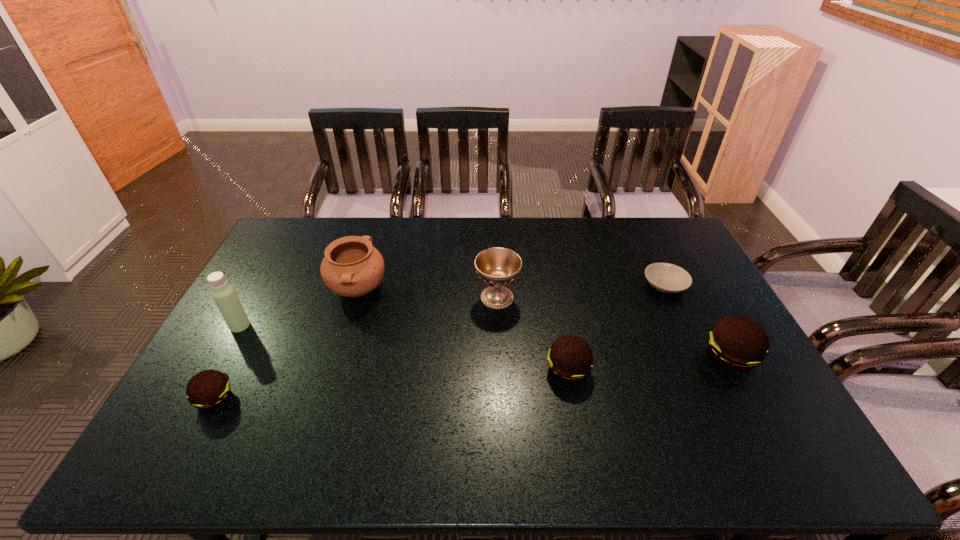
Locate an element on the screen. This screenshot has width=960, height=540. thermos bottle is located at coordinates (223, 293).

This screenshot has width=960, height=540. Identify the location of free space located 0.400m on the back of the shortest patty. (276, 283).

At what (x,y) coordinates should I click in order to perform the action: click on free point located on the left of the fifth object from left to right. Please return your answer as a coordinate pair (x, y). Looking at the image, I should click on (436, 370).

You are a GUI agent. You are given a task and a screenshot of the screen. Output one action in this format:
    pyautogui.click(x=<x>, y=<y>)
    Task: Click on the free space located on the back of the fourth shortest object
    
    Given the screenshot: What is the action you would take?
    pyautogui.click(x=676, y=256)

Where is `vacant space located 0.210m on the front of the shortest object`? This screenshot has width=960, height=540. vacant space located 0.210m on the front of the shortest object is located at coordinates (696, 353).

You are a GUI agent. You are given a task and a screenshot of the screen. Output one action in this format:
    pyautogui.click(x=<x>, y=<y>)
    Task: Click on the free region located 0.110m on the back of the third object from left to right
    The height and width of the screenshot is (540, 960).
    Given the screenshot: What is the action you would take?
    pyautogui.click(x=371, y=249)

Find the location of a particular element. free location located on the back of the fourth object from right to left is located at coordinates (494, 228).

Identify the location of vacant area situated 0.140m on the back of the fourth farthest object. This screenshot has width=960, height=540. (260, 288).

Identify the location of object located in the near edge section of the desktop. Image resolution: width=960 pixels, height=540 pixels. (209, 389).

The height and width of the screenshot is (540, 960). I want to click on patty present at the left edge, so click(209, 389).